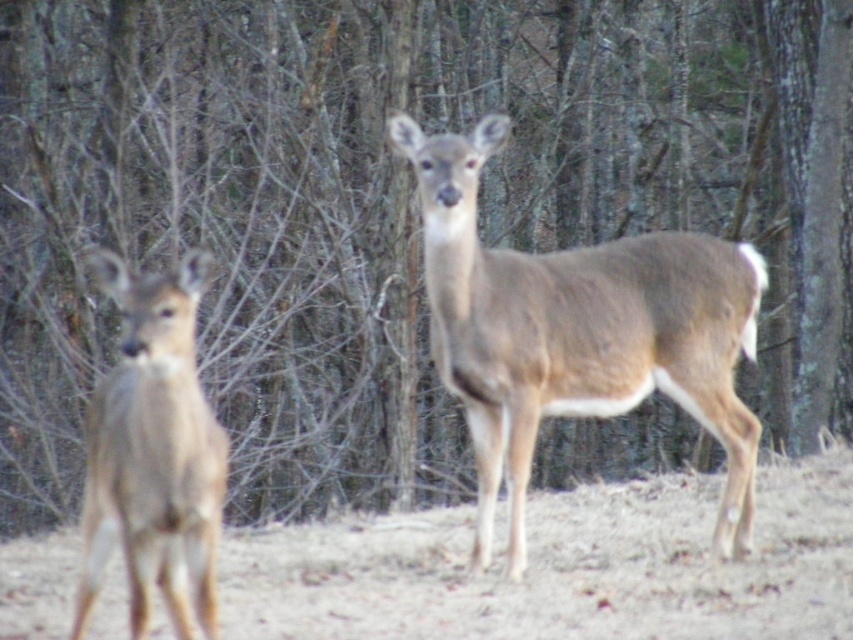
The height and width of the screenshot is (640, 853). What are the coordinates of `brown fur deer at center` in the screenshot? It's located at (578, 332).

Consider the image. Can you confirm if brown fur deer at center is positioned above brown fur deer at left?

Correct, brown fur deer at center is located above brown fur deer at left.

Is point (482, 518) behind point (201, 509)?

Yes, point (482, 518) is farther from viewer.

The image size is (853, 640). What are the coordinates of `brown fur deer at center` in the screenshot? It's located at (578, 332).